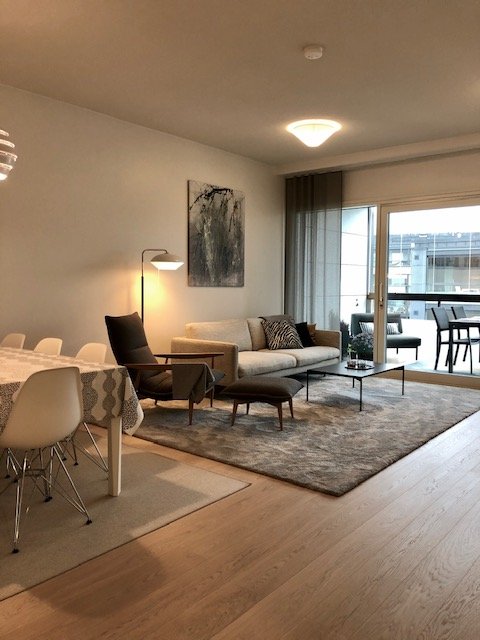
At what (x,y) coordinates should I click in order to perform the action: click on beige wall and ceiling. Please return your answer as a coordinate pair (x, y). This screenshot has height=640, width=480. Looking at the image, I should click on (221, 65), (93, 240).